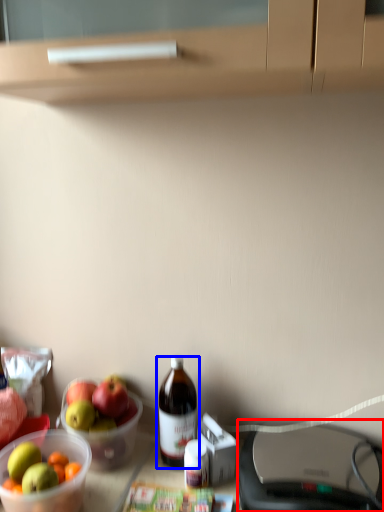
Question: Among these objects, which one is farthest to the camera, wide (highlighted by a red box) or bottle (highlighted by a blue box)?

Choices:
 (A) wide
 (B) bottle

Answer: (B)